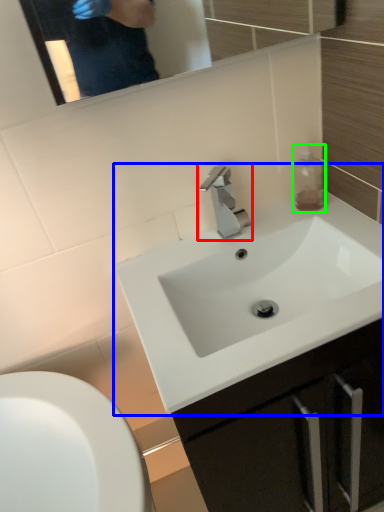
Question: Which object is the farthest from tap (highlighted by a red box)? Choose among these: sink (highlighted by a blue box) or bottle (highlighted by a green box).

Choices:
 (A) sink
 (B) bottle

Answer: (A)